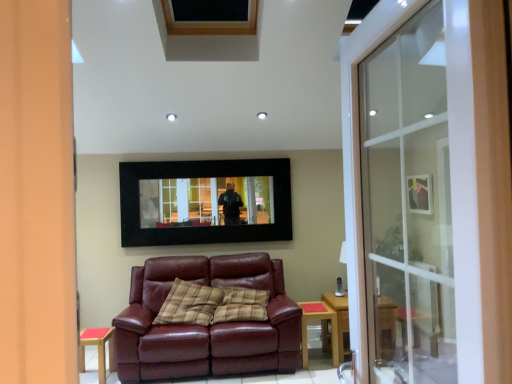
Question: In which direction should I rotate to look at light brown wooden side table at lower center?

Choices:
 (A) left
 (B) right

Answer: (B)

Question: Is the surface of matte leather couch at center in direct contact with plaid fabric pillow at center?

Choices:
 (A) yes
 (B) no

Answer: (B)

Question: Does matte leather couch at center have a lesser width compared to plaid fabric pillow at center?

Choices:
 (A) yes
 (B) no

Answer: (B)

Question: Does matte leather couch at center have a greater height compared to plaid fabric pillow at center?

Choices:
 (A) no
 (B) yes

Answer: (B)

Question: Does matte leather couch at center have a smaller size compared to plaid fabric pillow at center?

Choices:
 (A) yes
 (B) no

Answer: (B)

Question: Is matte leather couch at center not close to plaid fabric pillow at center?

Choices:
 (A) no
 (B) yes

Answer: (A)

Question: Considering the relative positions of matte leather couch at center and plaid fabric pillow at center in the image provided, is matte leather couch at center in front of plaid fabric pillow at center?

Choices:
 (A) yes
 (B) no

Answer: (A)

Question: From a real-world perspective, is transparent glass screen door at right physically below plaid fabric pillow at center?

Choices:
 (A) no
 (B) yes

Answer: (A)

Question: Can you confirm if transparent glass screen door at right is smaller than plaid fabric pillow at center?

Choices:
 (A) no
 (B) yes

Answer: (B)

Question: Does transparent glass screen door at right lie behind plaid fabric pillow at center?

Choices:
 (A) yes
 (B) no

Answer: (B)

Question: Is transparent glass screen door at right with plaid fabric pillow at center?

Choices:
 (A) no
 (B) yes

Answer: (A)

Question: Does transparent glass screen door at right come in front of plaid fabric pillow at center?

Choices:
 (A) yes
 (B) no

Answer: (A)

Question: Could you tell me if transparent glass screen door at right is facing plaid fabric pillow at center?

Choices:
 (A) yes
 (B) no

Answer: (B)

Question: Is matte black picture frame at upper right, acting as the second picture frame starting from the left, wider than plaid fabric pillow at center?

Choices:
 (A) yes
 (B) no

Answer: (B)